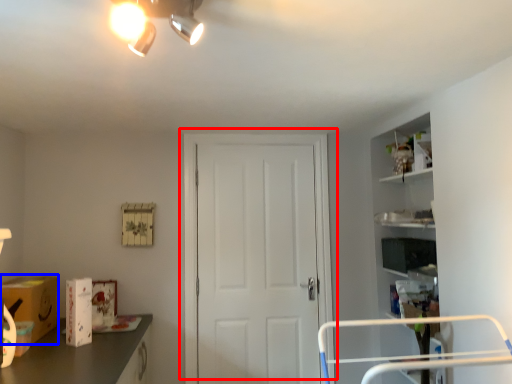
Question: Which of the following is the farthest to the observer, door (highlighted by a red box) or cardboard box (highlighted by a blue box)?

Choices:
 (A) door
 (B) cardboard box

Answer: (A)